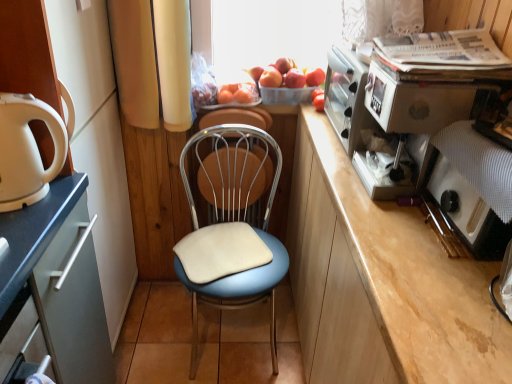
The image size is (512, 384). Describe the element at coordinates (82, 124) in the screenshot. I see `matte white cabinet at left` at that location.

Measure the distance between point (67, 44) and camera.

Point (67, 44) is 3.49 feet away from camera.

Where is `metallic silver coffee machine at upper right`? The height and width of the screenshot is (384, 512). metallic silver coffee machine at upper right is located at coordinates (402, 95).

Measure the distance between point (221, 90) and camera.

Point (221, 90) is 1.73 meters from camera.

The height and width of the screenshot is (384, 512). I want to click on matte white cabinet at left, so click(x=82, y=124).

Is smooth red apple at center, acting as the first apple starting from the left, to the right of metallic blue chair at center from the viewer's perspective?

Yes, smooth red apple at center, acting as the first apple starting from the left, is to the right of metallic blue chair at center.

From a real-world perspective, which is physically below, smooth red apple at center, acting as the first apple starting from the left, or metallic blue chair at center?

From a 3D spatial view, metallic blue chair at center is below.

Is smooth red apple at center, which is counted as the 2th apple, starting from the right, positioned beyond the bounds of metallic blue chair at center?

Absolutely, smooth red apple at center, which is counted as the 2th apple, starting from the right, is external to metallic blue chair at center.

How distant is white plastic kettle at left from blue fabric-covered chair at center?

white plastic kettle at left and blue fabric-covered chair at center are 30.29 inches apart.

Is white plastic kettle at left to the left of blue fabric-covered chair at center from the viewer's perspective?

Indeed, white plastic kettle at left is positioned on the left side of blue fabric-covered chair at center.

Is white plastic kettle at left facing towards blue fabric-covered chair at center?

No, white plastic kettle at left is not aimed at blue fabric-covered chair at center.

Which is behind, point (55, 125) or point (276, 162)?

The point (276, 162) is farther.

Is there a large distance between matte white cabinet at left and red matte apple at upper center, which ranks as the 1th apple in right-to-left order?

No, there isn't a large distance between matte white cabinet at left and red matte apple at upper center, which ranks as the 1th apple in right-to-left order.

Considering the sizes of objects matte white cabinet at left and red matte apple at upper center, which ranks as the 1th apple in right-to-left order, in the image provided, who is taller, matte white cabinet at left or red matte apple at upper center, which ranks as the 1th apple in right-to-left order,?

matte white cabinet at left is taller.

From a real-world perspective, is matte white cabinet at left positioned above or below red matte apple at upper center, which ranks as the 1th apple in right-to-left order?

Clearly, from a real-world perspective, matte white cabinet at left is below red matte apple at upper center, which ranks as the 1th apple in right-to-left order.

Between matte white cabinet at left and red matte apple at upper center, which ranks as the 1th apple in right-to-left order, which one appears on the left side from the viewer's perspective?

matte white cabinet at left.

Which object is thinner, metallic blue chair at center or red matte apple at upper center, which ranks as the 1th apple in right-to-left order?

Thinner between the two is metallic blue chair at center.

Is point (240, 119) behind point (301, 74)?

No, it is in front of (301, 74).

Considering the positions of objects metallic blue chair at center and red matte apple at upper center, which ranks as the 1th apple in right-to-left order, in the image provided, who is more to the left, metallic blue chair at center or red matte apple at upper center, which ranks as the 1th apple in right-to-left order,?

metallic blue chair at center.

From a real-world perspective, is metallic blue chair at center physically above red matte apple at upper center, which ranks as the 1th apple in right-to-left order?

No.

From the image's perspective, which is below, orange matte plastic basket at upper center or smooth red apple at center, which is counted as the 2th apple, starting from the right?

orange matte plastic basket at upper center.

Which object is further away from the camera taking this photo, orange matte plastic basket at upper center or smooth red apple at center, acting as the first apple starting from the left?

smooth red apple at center, acting as the first apple starting from the left.

Are orange matte plastic basket at upper center and smooth red apple at center, which is counted as the 2th apple, starting from the right, beside each other?

Yes, orange matte plastic basket at upper center is next to smooth red apple at center, which is counted as the 2th apple, starting from the right.

Is orange matte plastic basket at upper center looking in the opposite direction of smooth red apple at center, acting as the first apple starting from the left?

orange matte plastic basket at upper center does not have its back to smooth red apple at center, acting as the first apple starting from the left.

Between orange matte plastic basket at upper center and red matte apple at upper center, placed as the second apple when sorted from left to right, which one appears on the right side from the viewer's perspective?

From the viewer's perspective, red matte apple at upper center, placed as the second apple when sorted from left to right, appears more on the right side.

From the image's perspective, is orange matte plastic basket at upper center beneath red matte apple at upper center, which ranks as the 1th apple in right-to-left order?

Correct, orange matte plastic basket at upper center appears lower than red matte apple at upper center, which ranks as the 1th apple in right-to-left order, in the image.

Which apple is the 2nd one when counting from the right side of the orange matte plastic basket at upper center? Please provide its 2D coordinates.

[(295, 78)]

Considering the relative sizes of orange matte plastic basket at upper center and red matte apple at upper center, placed as the second apple when sorted from left to right, in the image provided, is orange matte plastic basket at upper center shorter than red matte apple at upper center, placed as the second apple when sorted from left to right,?

No.

Does blue fabric-covered chair at center turn towards metallic silver coffee machine at upper right?

No, blue fabric-covered chair at center is not turned towards metallic silver coffee machine at upper right.

Is blue fabric-covered chair at center far from metallic silver coffee machine at upper right?

blue fabric-covered chair at center is actually quite close to metallic silver coffee machine at upper right.

Find the location of a particular element. This screenshot has width=512, height=384. appliance located above the blue fabric-covered chair at center (from the image's perspective) is located at coordinates (402, 95).

The width and height of the screenshot is (512, 384). I want to click on armchair in front of the smooth red apple at center, acting as the first apple starting from the left, so click(237, 117).

Locate an element on the screen. The width and height of the screenshot is (512, 384). home appliance that appears above the blue fabric-covered chair at center (from the image's perspective) is located at coordinates (27, 150).

From the image, which object appears to be nearer to white plastic kettle at left, red matte apple at upper center, which ranks as the 1th apple in right-to-left order, or smooth red apple at center, acting as the first apple starting from the left?

The object closer to white plastic kettle at left is smooth red apple at center, acting as the first apple starting from the left.

Based on their spatial positions, is orange matte plastic basket at upper center or blue fabric-covered chair at center closer to matte white cabinet at left?

The object closer to matte white cabinet at left is blue fabric-covered chair at center.

Estimate the real-world distances between objects in this image. Which object is closer to smooth red apple at center, which is counted as the 2th apple, starting from the right, matte white cabinet at left or white plastic kettle at left?

matte white cabinet at left is positioned closer to the anchor smooth red apple at center, which is counted as the 2th apple, starting from the right.

When comparing their distances from metallic silver coffee machine at upper right, does orange matte plastic basket at upper center or white plastic kettle at left seem further?

white plastic kettle at left.

Considering their positions, is blue fabric-covered chair at center positioned closer to matte white cabinet at left than metallic silver coffee machine at upper right?

blue fabric-covered chair at center lies closer to matte white cabinet at left than the other object.

When comparing their distances from matte white cabinet at left, does red matte apple at upper center, which ranks as the 1th apple in right-to-left order, or blue fabric-covered chair at center seem closer?

Based on the image, blue fabric-covered chair at center appears to be nearer to matte white cabinet at left.

When comparing their distances from blue fabric-covered chair at center, does matte white cabinet at left or smooth red apple at center, acting as the first apple starting from the left, seem further?

smooth red apple at center, acting as the first apple starting from the left, lies further to blue fabric-covered chair at center than the other object.

From the picture: From the image, which object appears to be farther from blue fabric-covered chair at center, metallic blue chair at center or matte white cabinet at left?

matte white cabinet at left.

Locate an element on the screen. This screenshot has height=384, width=512. fruit positioned between white plastic kettle at left and smooth red apple at center, acting as the first apple starting from the left, from near to far is located at coordinates (237, 93).

Where is `chair between metallic silver coffee machine at upper right and metallic blue chair at center along the z-axis`? The image size is (512, 384). chair between metallic silver coffee machine at upper right and metallic blue chair at center along the z-axis is located at coordinates pos(233,224).

At what (x,y) coordinates should I click in order to perform the action: click on fruit located between metallic silver coffee machine at upper right and red matte apple at upper center, which ranks as the 1th apple in right-to-left order, in the depth direction. Please return your answer as a coordinate pair (x, y). This screenshot has height=384, width=512. Looking at the image, I should click on (237, 93).

Identify the location of fruit between smooth red apple at center, acting as the first apple starting from the left, and blue fabric-covered chair at center in the up-down direction. (x=237, y=93).